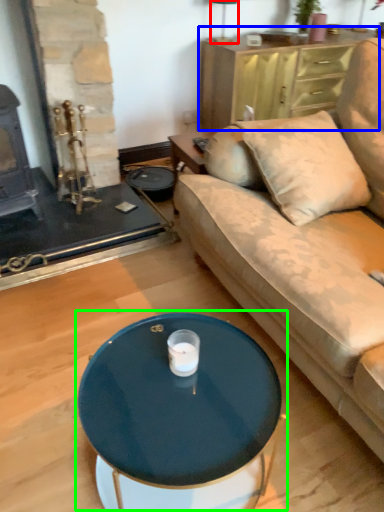
Question: Which is farther away from lamp (highlighted by a red box)? dresser (highlighted by a blue box) or coffee table (highlighted by a green box)?

Choices:
 (A) dresser
 (B) coffee table

Answer: (B)